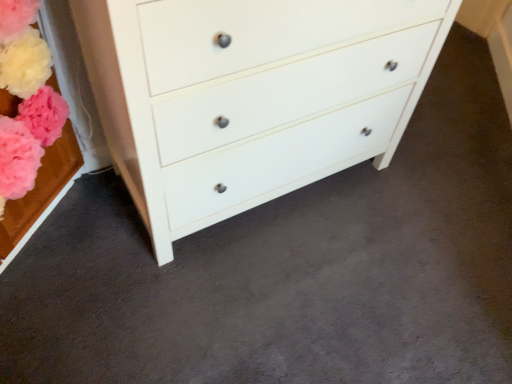
Locate an element on the screen. The height and width of the screenshot is (384, 512). spots to the right of white matte chest of drawers at center is located at coordinates (421, 231).